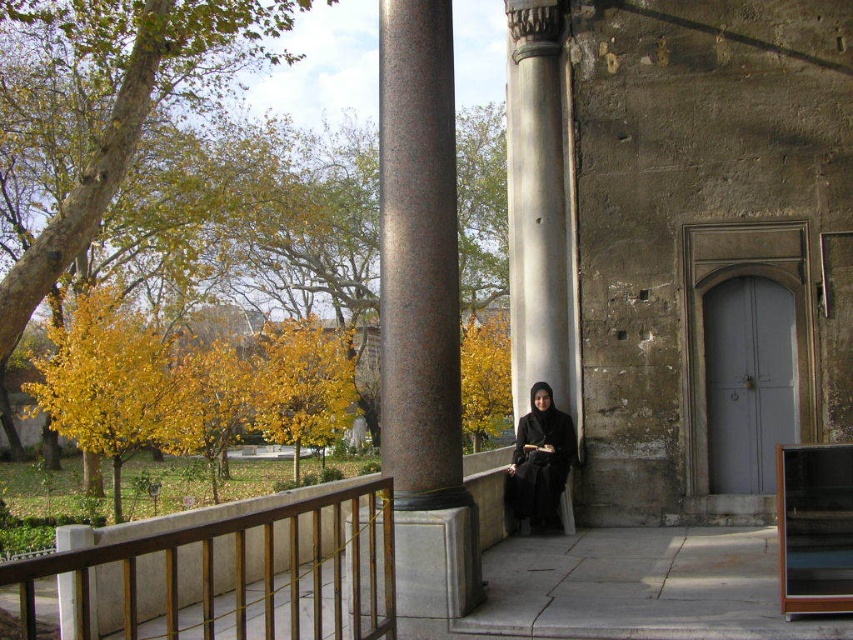
Question: Is polished granite column at center to the left of smooth stone column at center from the viewer's perspective?

Choices:
 (A) yes
 (B) no

Answer: (A)

Question: Among these objects, which one is farthest from the camera?

Choices:
 (A) smooth stone column at center
 (B) black matte dress at center

Answer: (A)

Question: Which object is positioned farthest from the brown wood railing at lower left?

Choices:
 (A) polished granite column at center
 (B) smooth stone column at center
 (C) black matte dress at center

Answer: (B)

Question: Estimate the real-world distances between objects in this image. Which object is closer to the brown wood railing at lower left?

Choices:
 (A) polished granite column at center
 (B) smooth stone column at center
 (C) black matte dress at center

Answer: (A)

Question: Is polished granite column at center to the right of smooth stone column at center from the viewer's perspective?

Choices:
 (A) yes
 (B) no

Answer: (B)

Question: Observing the image, what is the correct spatial positioning of brown wood railing at lower left in reference to smooth stone column at center?

Choices:
 (A) above
 (B) below

Answer: (B)